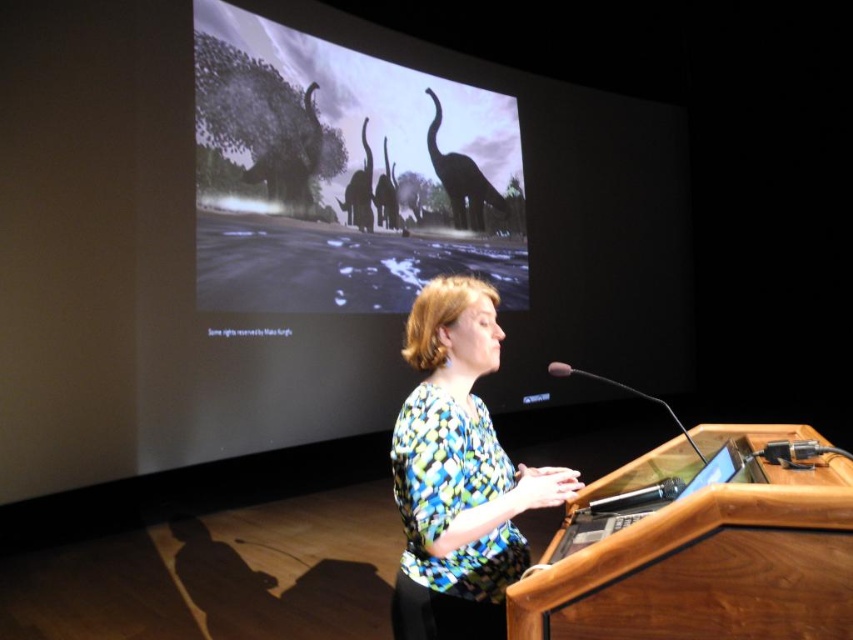
You are a speaker standing at the wooden podium at center. You need to reach the printed fabric blouse at center to adjust your collar. Can you do this without moving your feet?

The wooden podium at center and printed fabric blouse at center are 35.73 centimeters apart from each other. Since the distance is relatively short, you can likely reach the printed fabric blouse at center without moving your feet.

You are attending a lecture in the lecture hall and want to see both the silhouette matte elephants at upper center and the wooden podium at center clearly. Which object is closer to you, the observer?

The silhouette matte elephants at upper center are closer to you because the wooden podium at center is behind them.

You are standing in the lecture hall and want to reach the point marked at coordinates point (x=743, y=566). If your arm can extend 1 meter, can you reach it without moving your feet?

The point (x=743, y=566) is 98.97 centimeters away from the viewer. Since your arm can extend 1 meter, you can reach it without moving your feet.